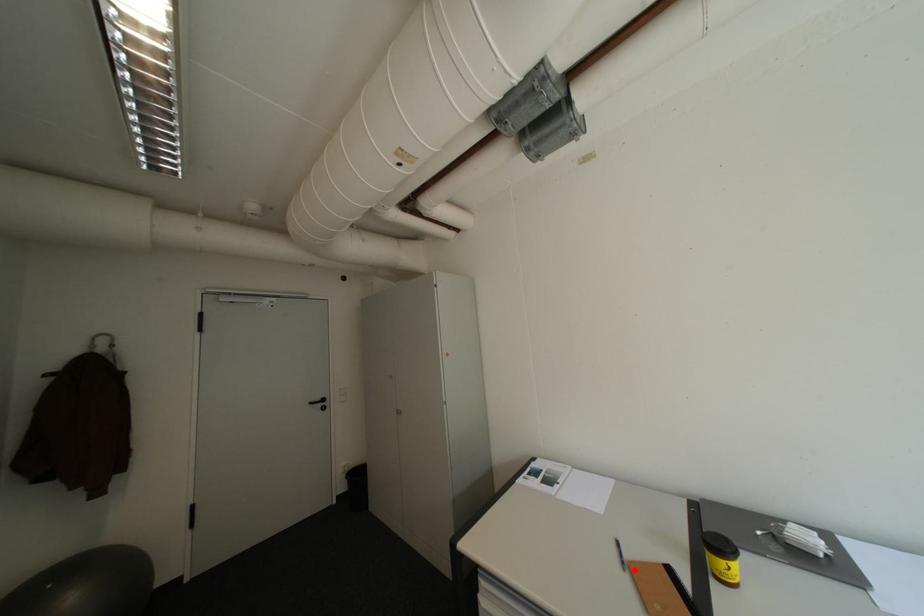
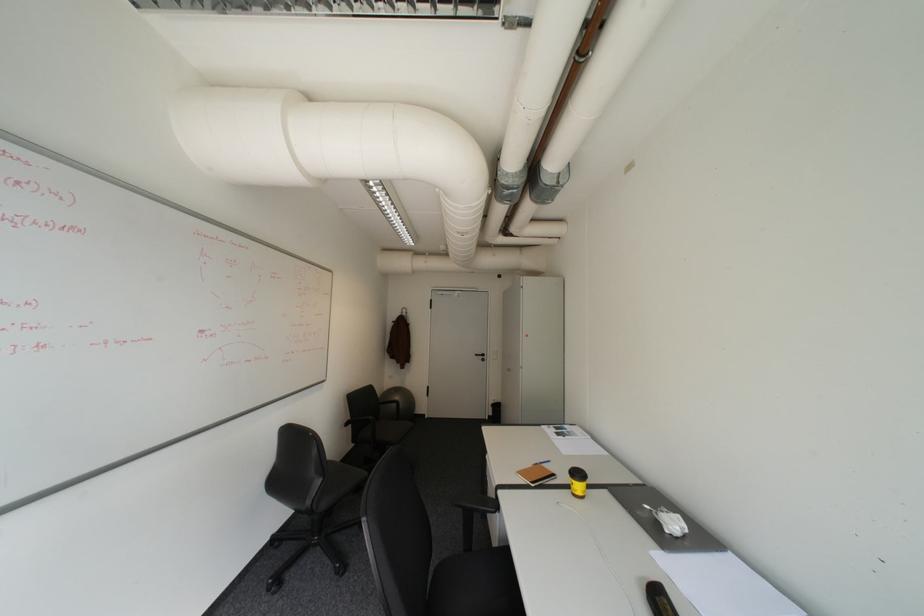
Where in the second image is the point corresponding to the highlighted location from the first image?

(543, 464)